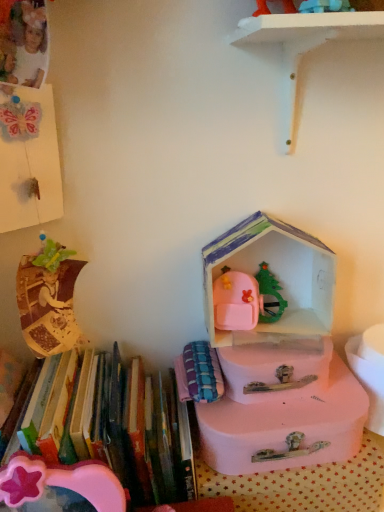
Identify the location of free point below pink cardboard house at center, acting as the 1th storage box starting from the top (from a real-world perspective). (275, 340).